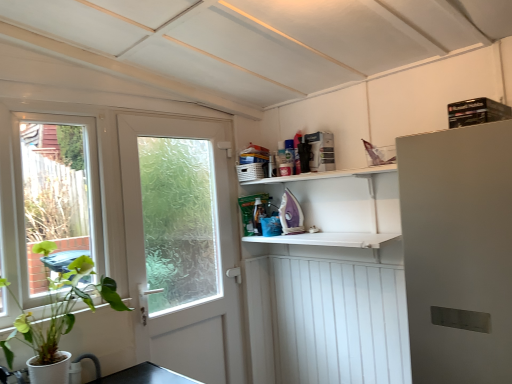
Question: In the image, is white matte door at left positioned in front of or behind white wooden radiator at lower right?

Choices:
 (A) front
 (B) behind

Answer: (A)

Question: From a real-world perspective, is white matte door at left physically located above or below white wooden radiator at lower right?

Choices:
 (A) below
 (B) above

Answer: (B)

Question: From the image's perspective, is white matte door at left above or below white wooden radiator at lower right?

Choices:
 (A) below
 (B) above

Answer: (B)

Question: From a real-world perspective, is white wooden radiator at lower right above or below white matte door at left?

Choices:
 (A) above
 (B) below

Answer: (B)

Question: From the image's perspective, relative to white matte door at left, is white wooden radiator at lower right above or below?

Choices:
 (A) below
 (B) above

Answer: (A)

Question: Looking at the image, does white wooden radiator at lower right seem bigger or smaller compared to white matte door at left?

Choices:
 (A) big
 (B) small

Answer: (A)

Question: In terms of height, does white wooden radiator at lower right look taller or shorter compared to white matte door at left?

Choices:
 (A) short
 (B) tall

Answer: (B)